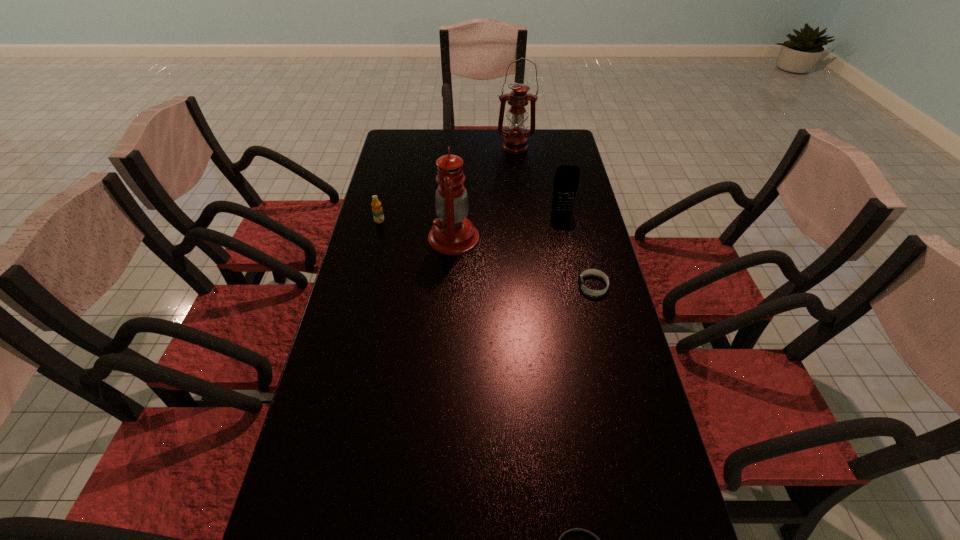
Find the location of `the farther oil lamp`. the farther oil lamp is located at coordinates (515, 140).

Locate an element on the screen. the farthest object is located at coordinates (515, 140).

Where is `the left oil lamp`? The height and width of the screenshot is (540, 960). the left oil lamp is located at coordinates (452, 233).

This screenshot has width=960, height=540. I want to click on the fifth object from right to left, so click(452, 233).

Locate an element on the screen. The image size is (960, 540). cellular telephone is located at coordinates (566, 180).

Where is `the fourth shortest object`? The height and width of the screenshot is (540, 960). the fourth shortest object is located at coordinates (566, 180).

Locate an element on the screen. the leftmost object is located at coordinates (377, 210).

The width and height of the screenshot is (960, 540). Identify the location of orange juice. (377, 210).

Find the location of a particular element. the farther wristband is located at coordinates (589, 271).

Where is `the second nearest object`? the second nearest object is located at coordinates (589, 271).